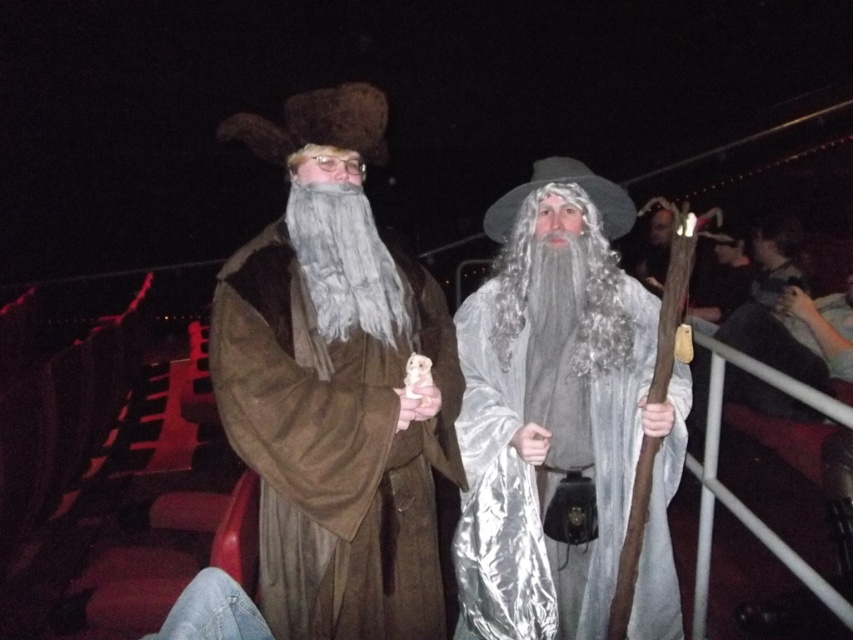
Question: Estimate the real-world distances between objects in this image. Which object is farther from the gray/curly hair at center?

Choices:
 (A) gray fuzzy beard at center
 (B) brown suede hat at upper left

Answer: (A)

Question: Which of the following is the closest to the observer?

Choices:
 (A) silver satin robe at center
 (B) brown suede hat at upper left
 (C) gray/curly hair at center

Answer: (B)

Question: Which point is farther from the camera taking this photo?

Choices:
 (A) (664, 520)
 (B) (276, 442)

Answer: (A)

Question: Can you confirm if brown suede hat at upper left is positioned to the right of silver satin robe at center?

Choices:
 (A) no
 (B) yes

Answer: (A)

Question: Considering the relative positions of brown suede hat at upper left and silver satin robe at center in the image provided, where is brown suede hat at upper left located with respect to silver satin robe at center?

Choices:
 (A) left
 (B) right

Answer: (A)

Question: Can you confirm if brown suede hat at upper left is positioned to the left of silver satin robe at center?

Choices:
 (A) yes
 (B) no

Answer: (A)